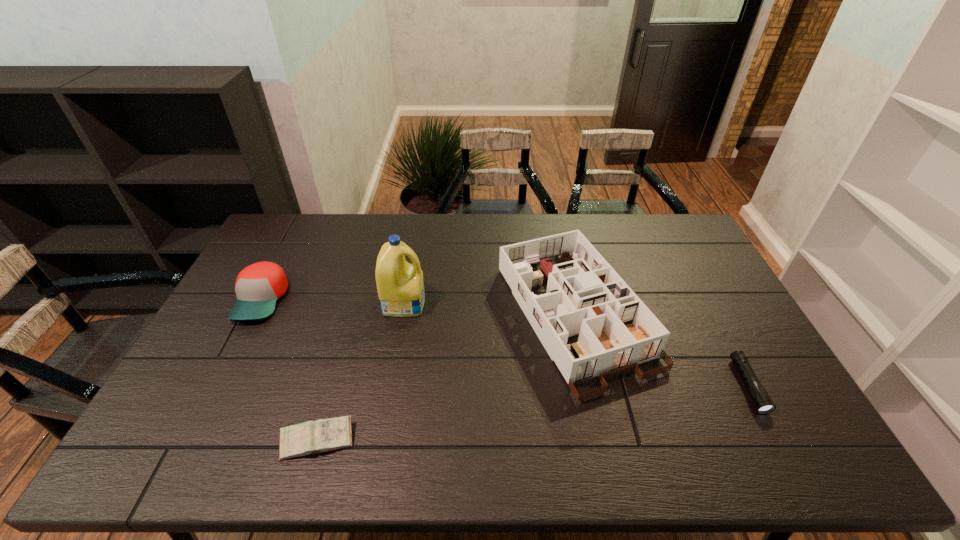
I want to click on the third closest object to the detergent, so click(311, 437).

Image resolution: width=960 pixels, height=540 pixels. In order to click on object that stands as the closest to the fourth tallest object in this screenshot , I will do `click(258, 286)`.

I want to click on vacant point that satisfies the following two spatial constraints: 1. on the label of the detergent; 2. on the front side of the nearest object, so click(379, 440).

Find the location of `vacant area that satisfies the following two spatial constraints: 1. at the brim of the leftmost object; 2. on the left side of the fourth object from left to right`. vacant area that satisfies the following two spatial constraints: 1. at the brim of the leftmost object; 2. on the left side of the fourth object from left to right is located at coordinates pos(253,315).

Where is `blank space that satisfies the following two spatial constraints: 1. at the brim of the leftmost object; 2. on the left side of the dollhouse`? blank space that satisfies the following two spatial constraints: 1. at the brim of the leftmost object; 2. on the left side of the dollhouse is located at coordinates (253, 315).